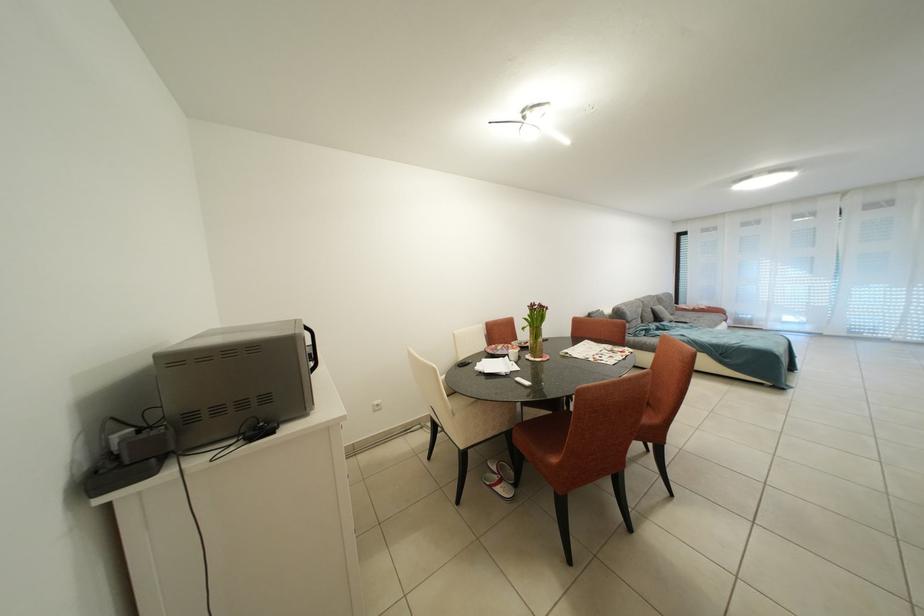
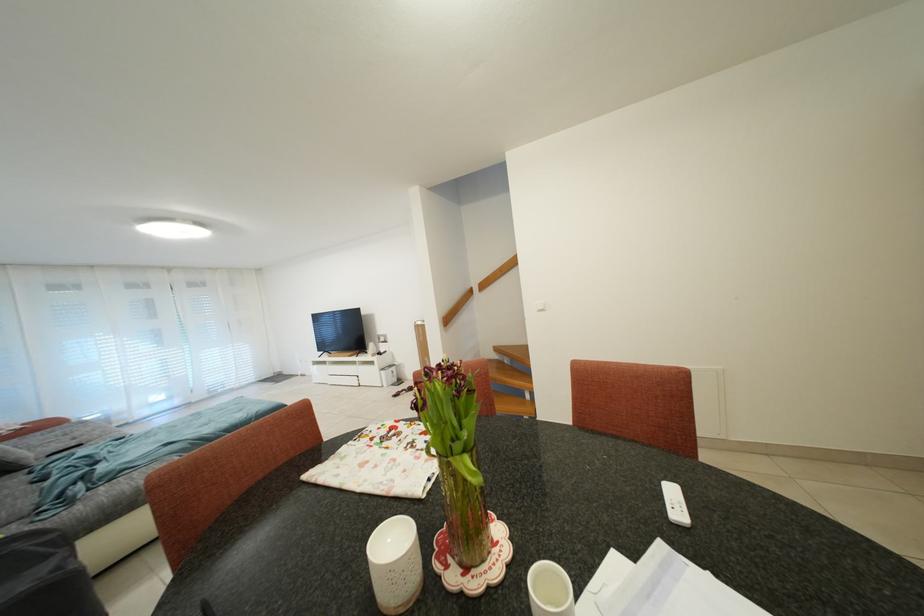
Find the pixel in the second image that matches point (670, 321) in the first image.

(19, 462)